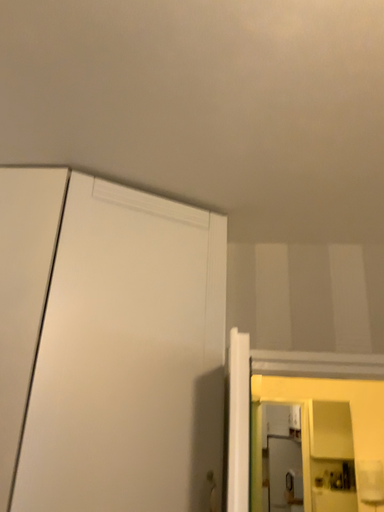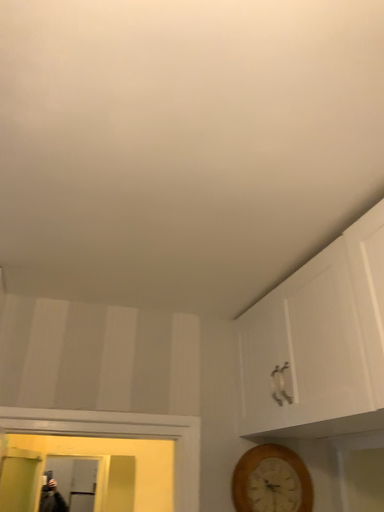
Question: How did the camera likely rotate when shooting the video?

Choices:
 (A) rotated left
 (B) rotated right

Answer: (B)